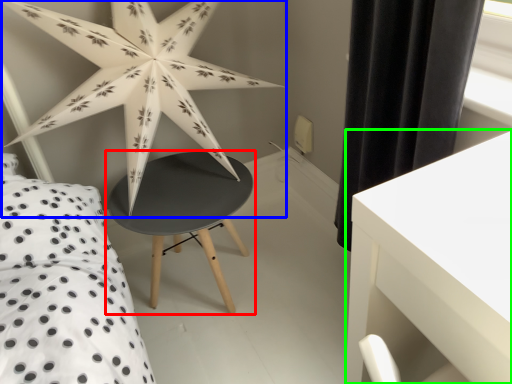
Question: Based on their relative distances, which object is nearer to table (highlighted by a red box)? Choose from star (highlighted by a blue box) and table (highlighted by a green box).

Choices:
 (A) star
 (B) table

Answer: (A)